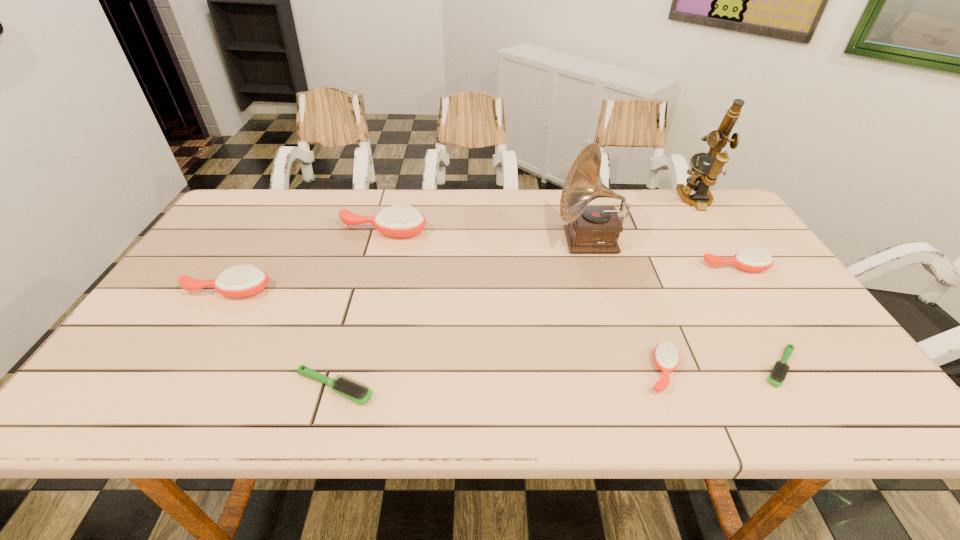
Identify the location of vacant space that satisfies the following two spatial constraints: 1. on the horn of the brown phonograph record; 2. on the front side of the fourth nearest hairbrush. (604, 291).